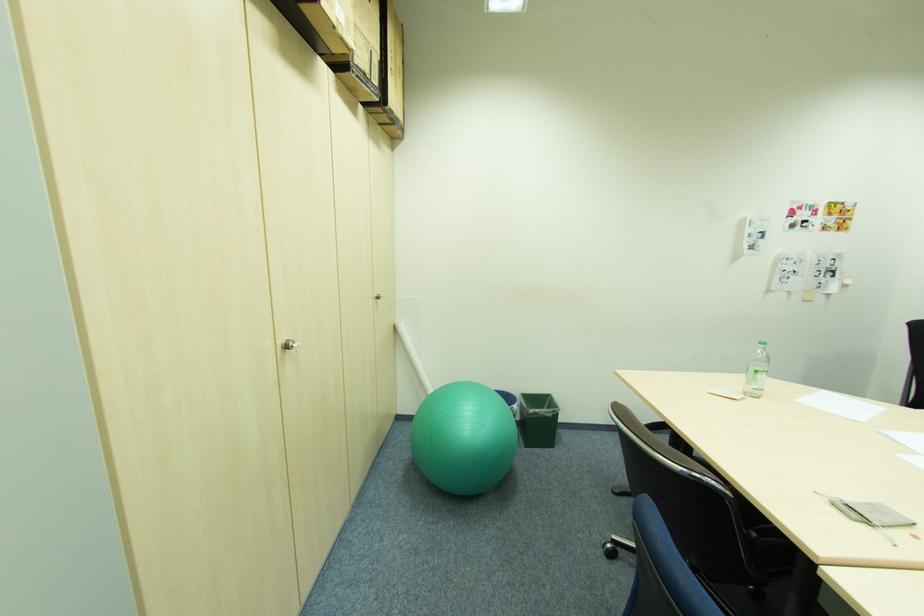
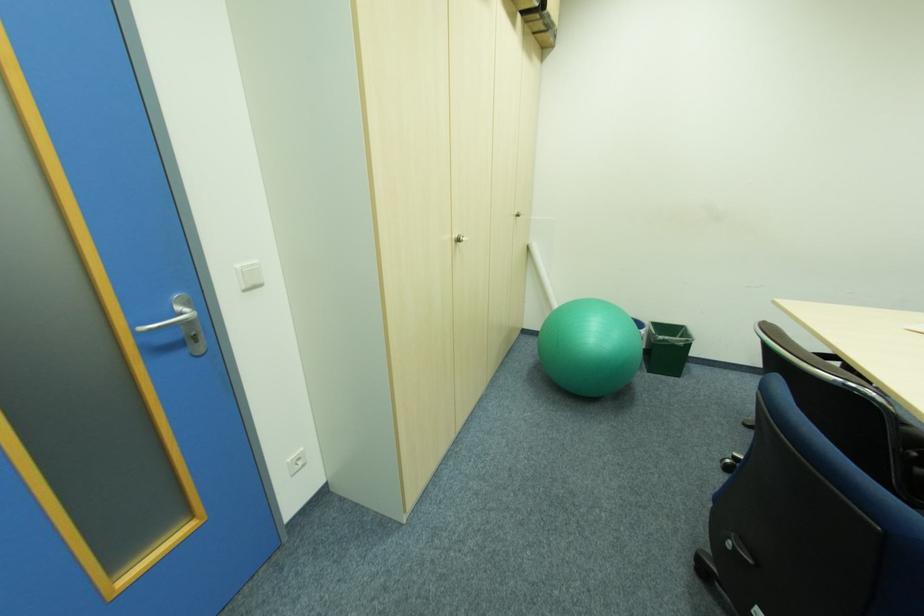
Where in the second image is the point corresponding to pixel 531 447 from the first image?

(653, 371)